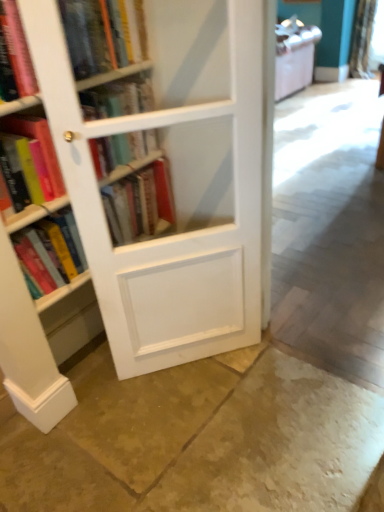
Identify the location of vacant area to the right of white wood bookcase at left. (267, 384).